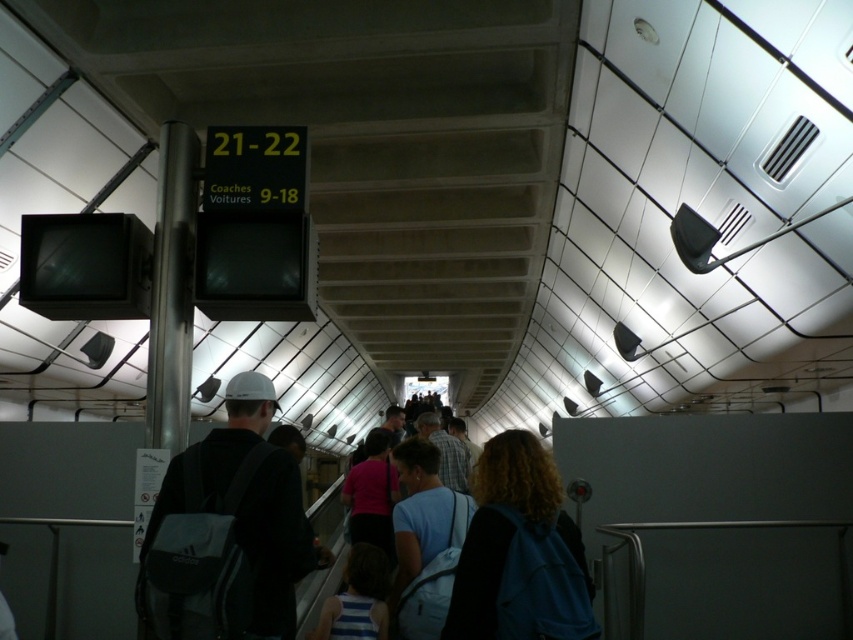
Can you confirm if black fabric backpack at center is thinner than blue backpack at center?

In fact, black fabric backpack at center might be wider than blue backpack at center.

Can you confirm if black fabric backpack at center is positioned below blue backpack at center?

Yes, black fabric backpack at center is below blue backpack at center.

In the scene shown: Who is more forward, (285, 476) or (538, 604)?

Point (538, 604) is more forward.

This screenshot has width=853, height=640. I want to click on black fabric backpack at center, so click(x=229, y=529).